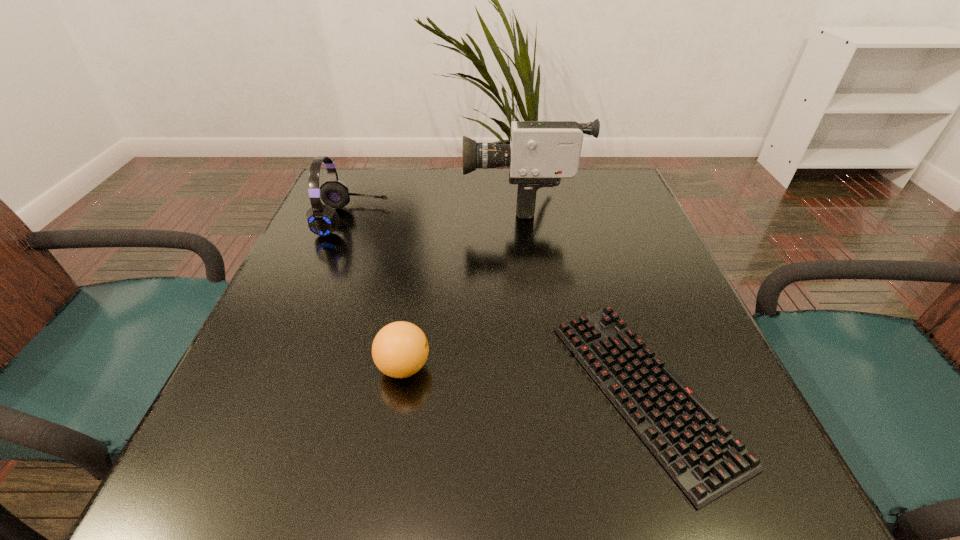
Locate which object is the closest to the camcorder. Please provide its 2D coordinates. Your answer should be formatted as a tuple, i.e. [(x, y)], where the tuple contains the x and y coordinates of a point satisfying the conditions above.

[(323, 220)]

The image size is (960, 540). I want to click on vacant region that satisfies the following two spatial constraints: 1. on the recording direction of the tallest object; 2. on the left side of the shortest object, so click(548, 391).

At what (x,y) coordinates should I click in order to perform the action: click on vacant point that satisfies the following two spatial constraints: 1. on the side with brand of the ping-pong ball; 2. on the left side of the computer keyboard. Please return your answer as a coordinate pair (x, y). Image resolution: width=960 pixels, height=540 pixels. Looking at the image, I should click on (399, 391).

The image size is (960, 540). In order to click on free space that satisfies the following two spatial constraints: 1. on the ear cushions of the leftmost object; 2. on the right side of the computer keyboard in this screenshot , I will do `click(285, 391)`.

Locate an element on the screen. The height and width of the screenshot is (540, 960). vacant area that satisfies the following two spatial constraints: 1. on the side with brand of the computer keyboard; 2. on the left side of the ping-pong ball is located at coordinates (399, 391).

Where is `vacant position in the image that satisfies the following two spatial constraints: 1. on the recording direction of the shortest object; 2. on the right side of the camcorder`? This screenshot has height=540, width=960. vacant position in the image that satisfies the following two spatial constraints: 1. on the recording direction of the shortest object; 2. on the right side of the camcorder is located at coordinates (548, 391).

Find the location of `vacant space that satisfies the following two spatial constraints: 1. on the recording direction of the tallest object; 2. on the right side of the shortest object`. vacant space that satisfies the following two spatial constraints: 1. on the recording direction of the tallest object; 2. on the right side of the shortest object is located at coordinates (548, 391).